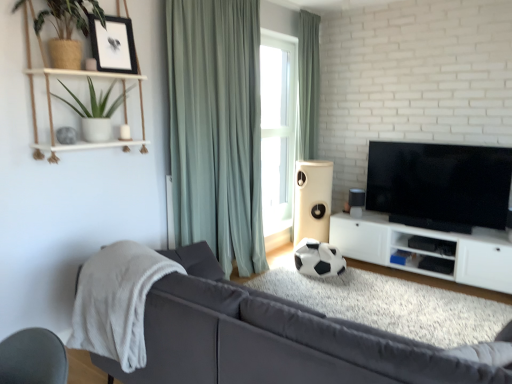
Question: Is point (112, 253) closer or farther from the camera than point (179, 165)?

Choices:
 (A) farther
 (B) closer

Answer: (B)

Question: Is white fluffy blanket at left wider or thinner than green fabric curtain at center, which is counted as the 2th curtain, starting from the back?

Choices:
 (A) thin
 (B) wide

Answer: (B)

Question: Which object is the farthest from the white wood shelf at upper left?

Choices:
 (A) light green fabric curtain at upper center, placed as the 2th curtain when sorted from left to right
 (B) green fabric curtain at center, the first curtain when ordered from front to back
 (C) white matte cabinet at lower right
 (D) black matte picture frame at upper left
 (E) satin black speaker at lower right, which is the 1th speaker from right to left

Answer: (C)

Question: Considering the real-world distances, which object is closest to the green matte plant at upper left?

Choices:
 (A) white matte cabinet at lower right
 (B) light green fabric curtain at upper center, which is counted as the 1th curtain, starting from the back
 (C) matte white speaker at center, positioned as the 2th speaker in right-to-left order
 (D) matte gray couch at center
 (E) satin black speaker at lower right, which is the 1th speaker from right to left

Answer: (D)